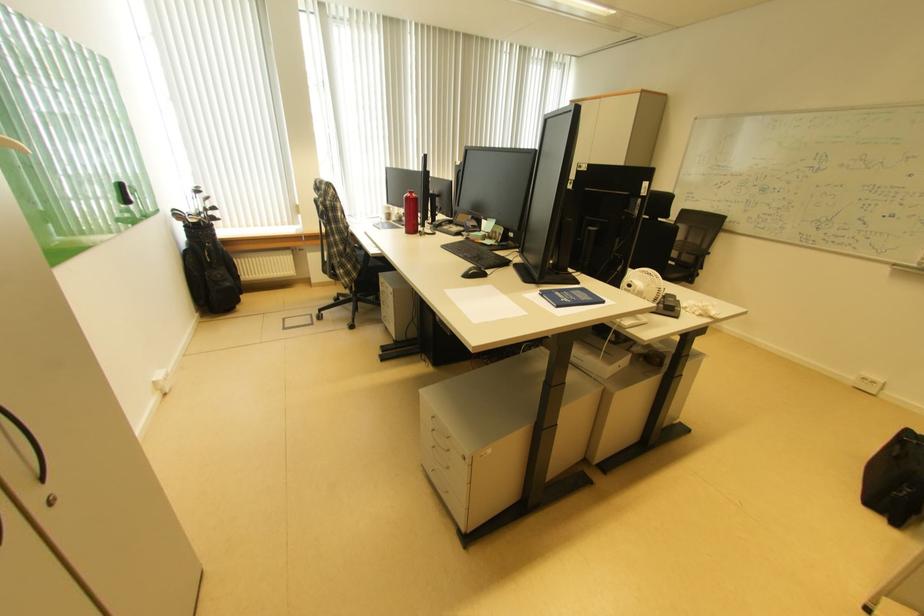
Where would you lift the blue book? Please return your answer as a coordinate pair (x, y).

(570, 297)